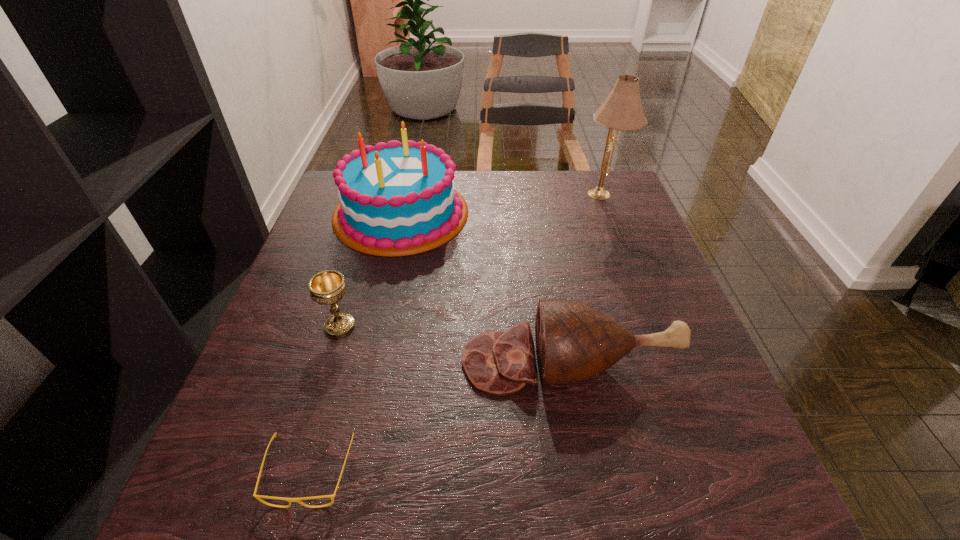
Image resolution: width=960 pixels, height=540 pixels. What are the coordinates of `free location located 0.310m at the sliced end of the ham` in the screenshot? It's located at (295, 361).

Locate an element on the screen. blank area located 0.230m on the back of the chalice is located at coordinates (365, 244).

Image resolution: width=960 pixels, height=540 pixels. What are the coordinates of `lampshade situated at the far edge` in the screenshot? It's located at (622, 110).

The height and width of the screenshot is (540, 960). I want to click on birthday cake that is at the far edge, so click(x=396, y=199).

Find the location of a particular element. object present at the near edge is located at coordinates (258, 497).

The image size is (960, 540). I want to click on birthday cake that is at the left edge, so pos(396,199).

This screenshot has height=540, width=960. Find the location of `chalice that is at the left edge`. chalice that is at the left edge is located at coordinates (328, 287).

This screenshot has width=960, height=540. I want to click on spectacles located at the left edge, so click(x=258, y=497).

What are the coordinates of `lampshade located at the right edge` in the screenshot? It's located at (622, 110).

Locate an element on the screen. ham that is at the right edge is located at coordinates (574, 341).